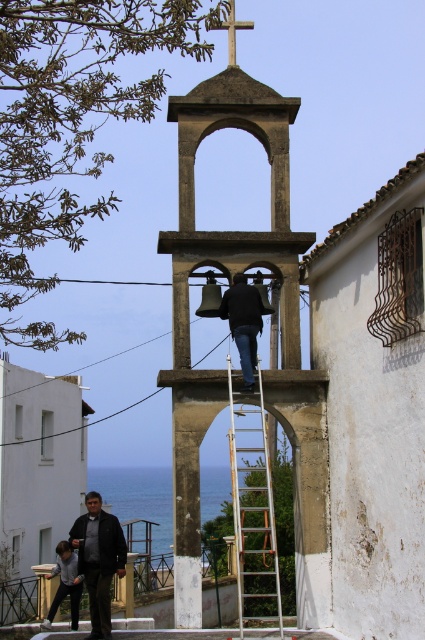
The height and width of the screenshot is (640, 425). Find the location of `white metallic ladder at center`. white metallic ladder at center is located at coordinates tap(252, 508).

Is white metallic ladder at center wider than wooden cross at upper center?

Correct, the width of white metallic ladder at center exceeds that of wooden cross at upper center.

Is point (271, 548) closer to camera compared to point (232, 6)?

Yes, it is in front of point (232, 6).

At what (x,y) coordinates should I click in order to perform the action: click on white metallic ladder at center. Please return your answer as a coordinate pair (x, y). The image size is (425, 640). Looking at the image, I should click on (252, 508).

Does dark gray stone bell tower at center have a greater width compared to dark gray jacket at lower left?

Yes.

Is point (224, 109) positioned in front of point (104, 524)?

No, it is not.

Is point (158, 372) positioned behind point (70, 540)?

No, (158, 372) is closer to viewer.

The image size is (425, 640). What are the coordinates of `dark gray stone bell tower at center` in the screenshot? It's located at (231, 280).

Between point (283, 204) and point (232, 58), which one is positioned in front?

Point (283, 204) is more forward.

Consider the image. Is dark gray stone bell tower at center positioned before wooden cross at upper center?

No, dark gray stone bell tower at center is behind wooden cross at upper center.

Which is behind, point (300, 378) or point (244, 22)?

Positioned behind is point (244, 22).

You are a GUI agent. You are given a task and a screenshot of the screen. Output one action in this format:
    pyautogui.click(x=<x>, y=<y>)
    Task: Click on the dark gray stone bell tower at center
    
    Given the screenshot: What is the action you would take?
    pyautogui.click(x=231, y=280)